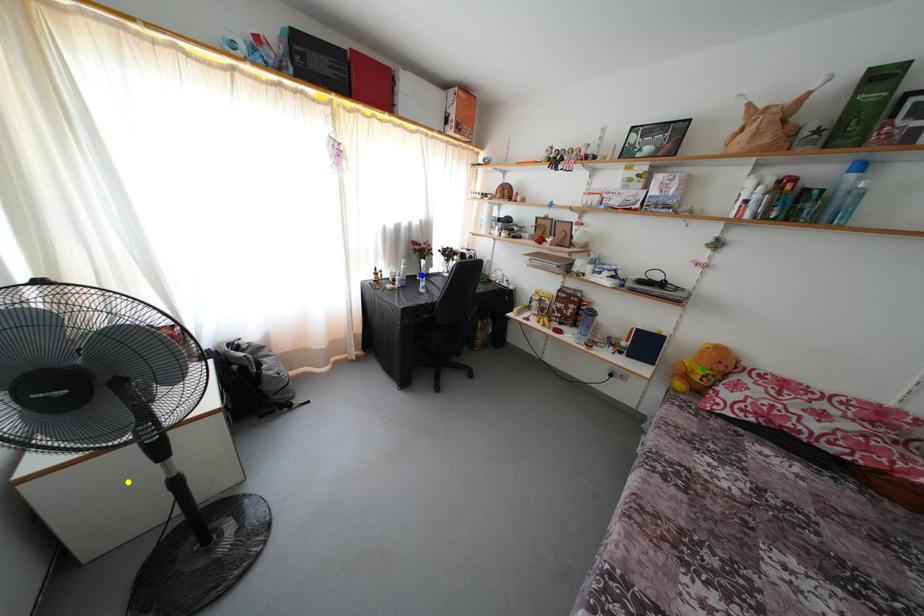
Order these from nearest to farthest:
- yellow point
- blue point
- green point

yellow point → green point → blue point